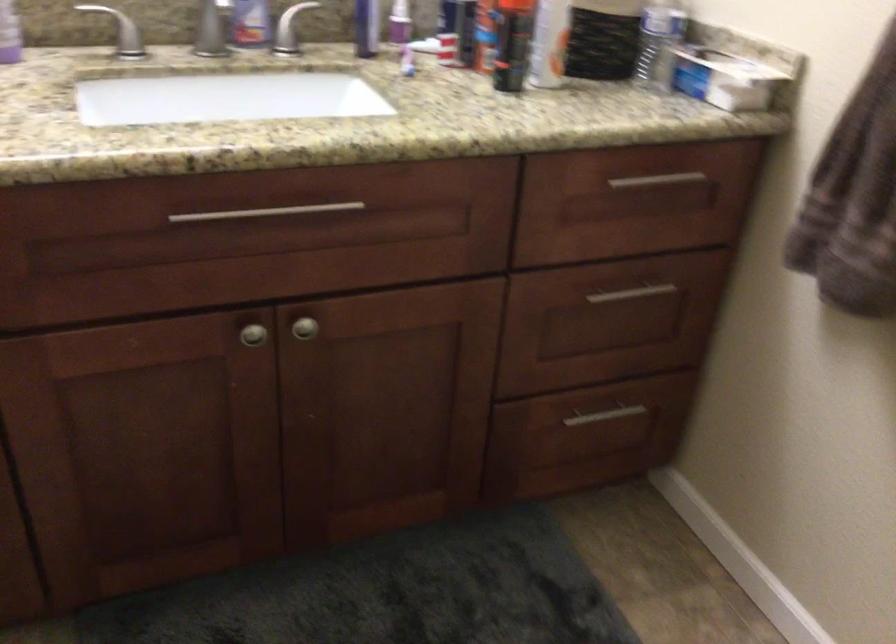
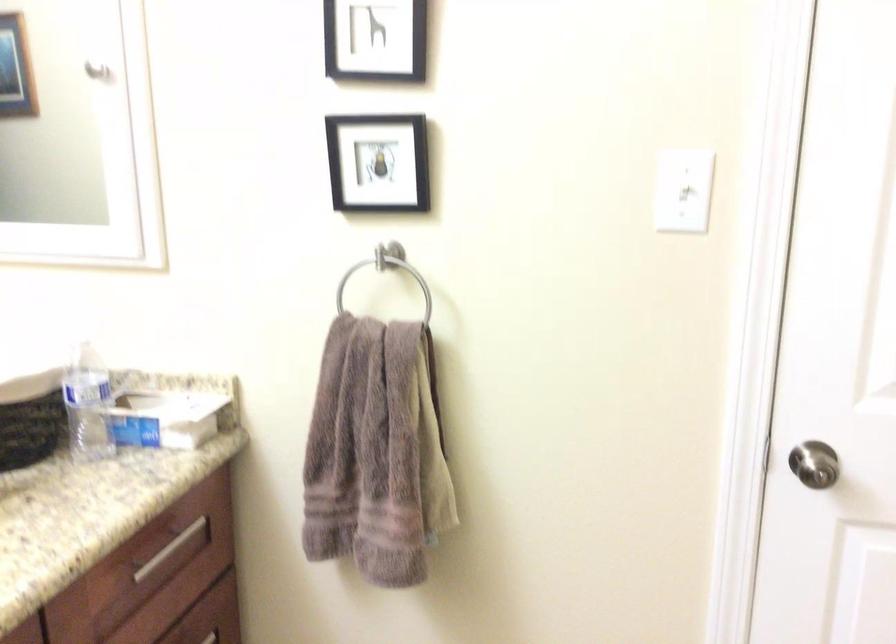
Question: The camera is either moving clockwise (left) or counter-clockwise (right) around the object. The first image is from the beginning of the video and the second image is from the end. Is the camera moving left or right when shooting the video?

Choices:
 (A) Left
 (B) Right

Answer: (A)